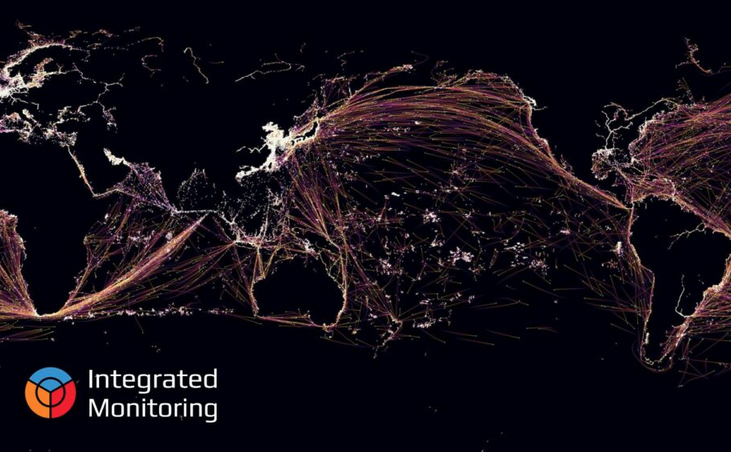
I want to click on art work, so click(373, 167).